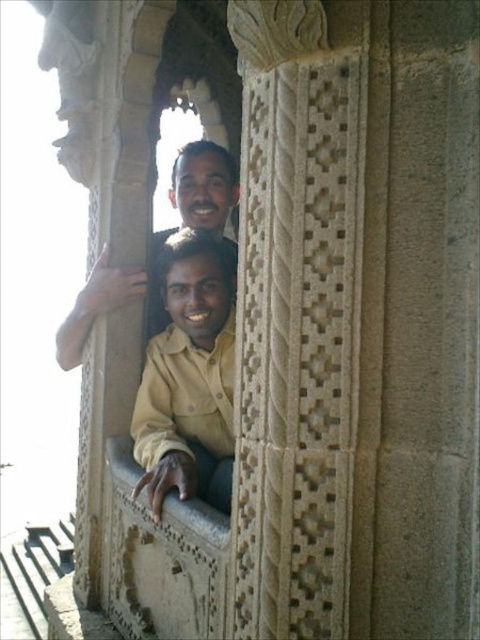
Question: Which point is farther to the camera?

Choices:
 (A) (189, 168)
 (B) (217, 260)

Answer: (A)

Question: Where is light brown fabric shirt at lower center located in relation to matte beige shirt at center in the image?

Choices:
 (A) right
 (B) left

Answer: (A)

Question: Based on their relative distances, which object is nearer to the matte beige shirt at center?

Choices:
 (A) light brown fabric shirt at lower center
 (B) white stone window sill at center

Answer: (A)

Question: Does light brown fabric shirt at lower center have a lesser width compared to matte beige shirt at center?

Choices:
 (A) no
 (B) yes

Answer: (A)

Question: Can you confirm if light brown fabric shirt at lower center is wider than white stone window sill at center?

Choices:
 (A) yes
 (B) no

Answer: (B)

Question: Which point appears farthest from the camera in this image?

Choices:
 (A) (121, 481)
 (B) (218, 228)
 (C) (224, 266)

Answer: (B)